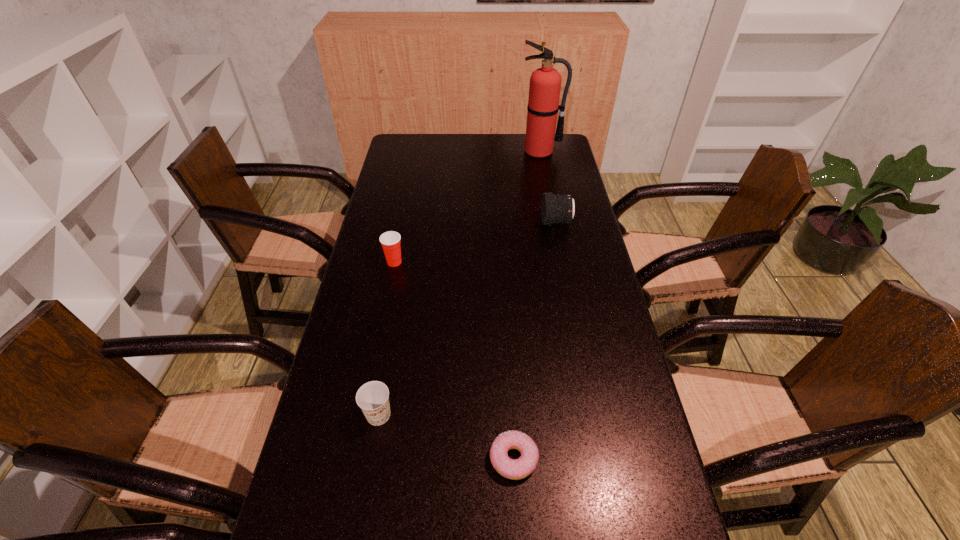
This screenshot has height=540, width=960. In the image, there is a desktop. In order to click on free space at the left edge in this screenshot , I will do `click(371, 376)`.

You are a GUI agent. You are given a task and a screenshot of the screen. Output one action in this format:
    pyautogui.click(x=<x>, y=<y>)
    Task: Click on the vacant space at the right edge of the desktop
    This screenshot has width=960, height=540.
    Given the screenshot: What is the action you would take?
    pyautogui.click(x=554, y=256)

Where is `free spot at the far right corner of the desktop`? The height and width of the screenshot is (540, 960). free spot at the far right corner of the desktop is located at coordinates (562, 158).

Find the location of a particular element. The width and height of the screenshot is (960, 540). vacant area that lies between the fourth tallest object and the farther Dixie cup is located at coordinates (387, 339).

You are a GUI agent. You are given a task and a screenshot of the screen. Output one action in this format:
    pyautogui.click(x=<x>, y=<y>)
    Task: Click on the vacant point located between the fourth nearest object and the farther Dixie cup
    Image resolution: width=960 pixels, height=540 pixels.
    Given the screenshot: What is the action you would take?
    pyautogui.click(x=475, y=242)

Locate an element on the screen. This screenshot has width=960, height=540. vacant space that's between the nearer Dixie cup and the farthest object is located at coordinates (459, 283).

Identify the location of free space between the tallest object and the farther Dixie cup. (468, 207).

What are the coordinates of `empty location between the tallest object and the nearest object` in the screenshot? It's located at (527, 305).

The height and width of the screenshot is (540, 960). I want to click on unoccupied area between the nearer Dixie cup and the second farthest object, so click(468, 319).

The width and height of the screenshot is (960, 540). I want to click on free point between the nearer Dixie cup and the telephoto lens, so click(x=468, y=319).